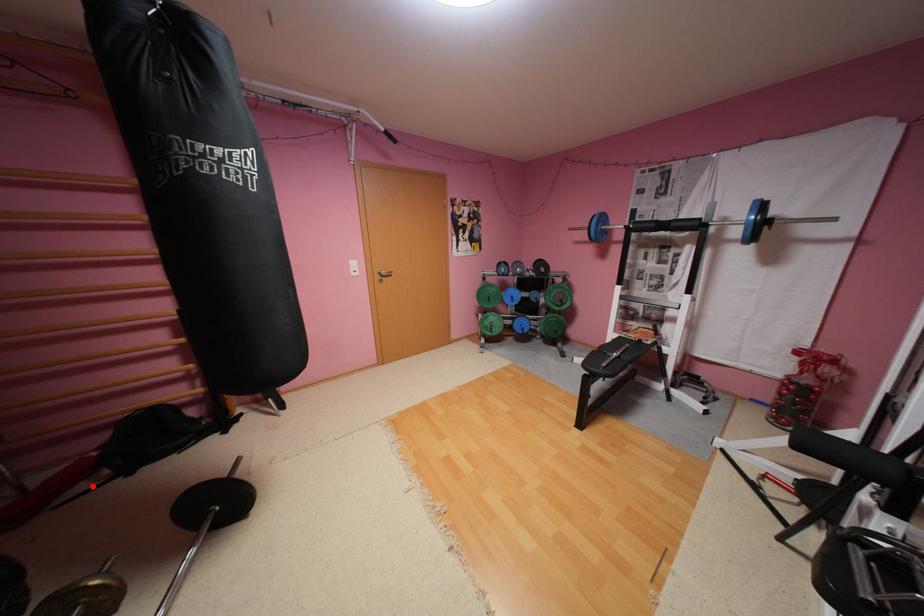
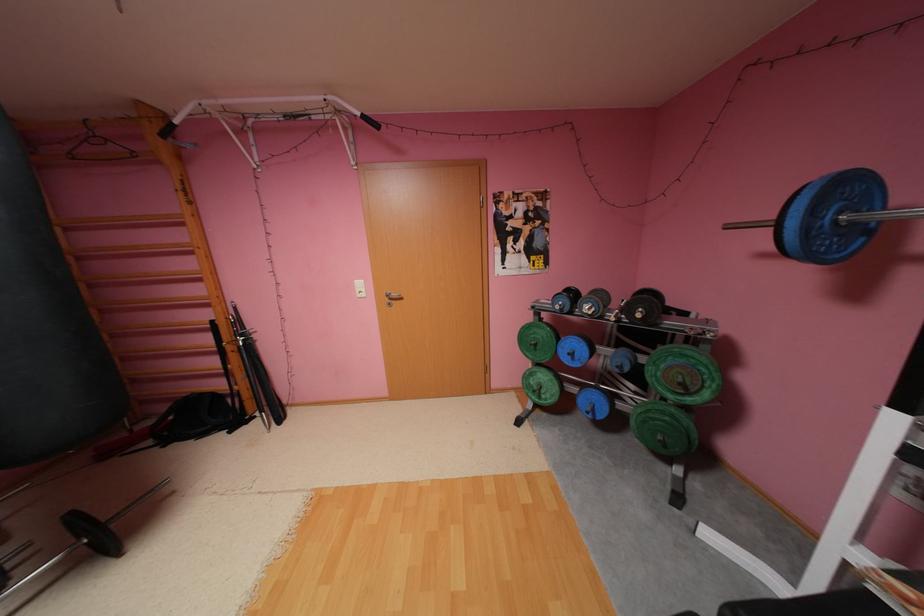
In the second image, find the point that corresponds to the highlighted location in the first image.

(157, 442)